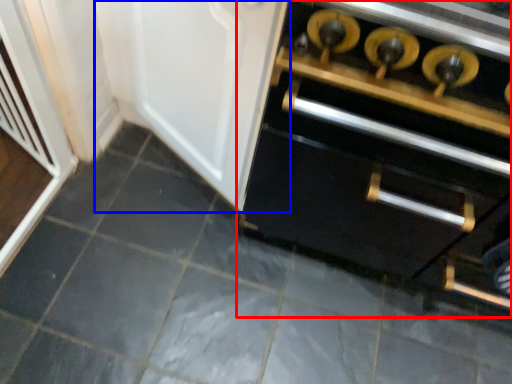
Question: Which point is closer to the camera, cabinetry (highlighted by a red box) or door (highlighted by a blue box)?

Choices:
 (A) cabinetry
 (B) door

Answer: (A)